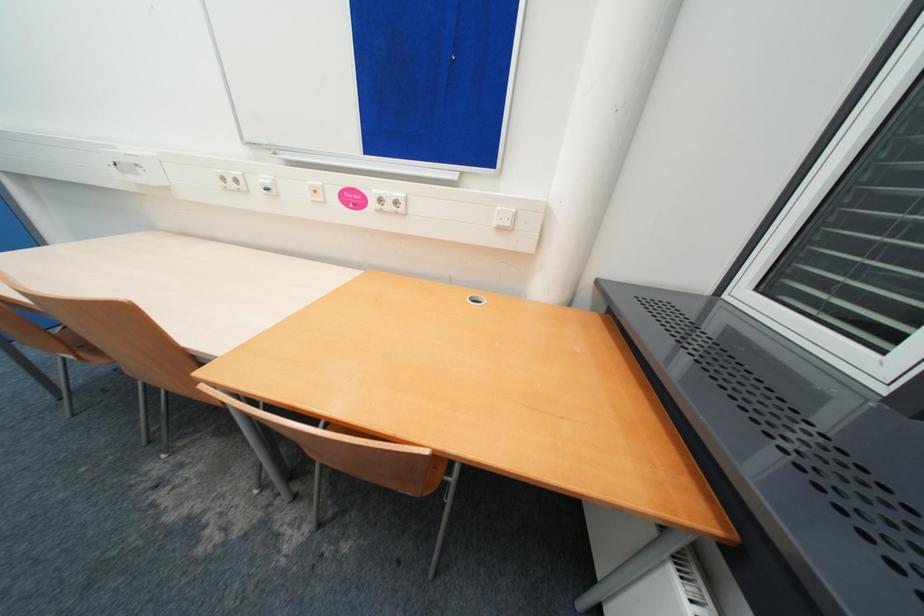
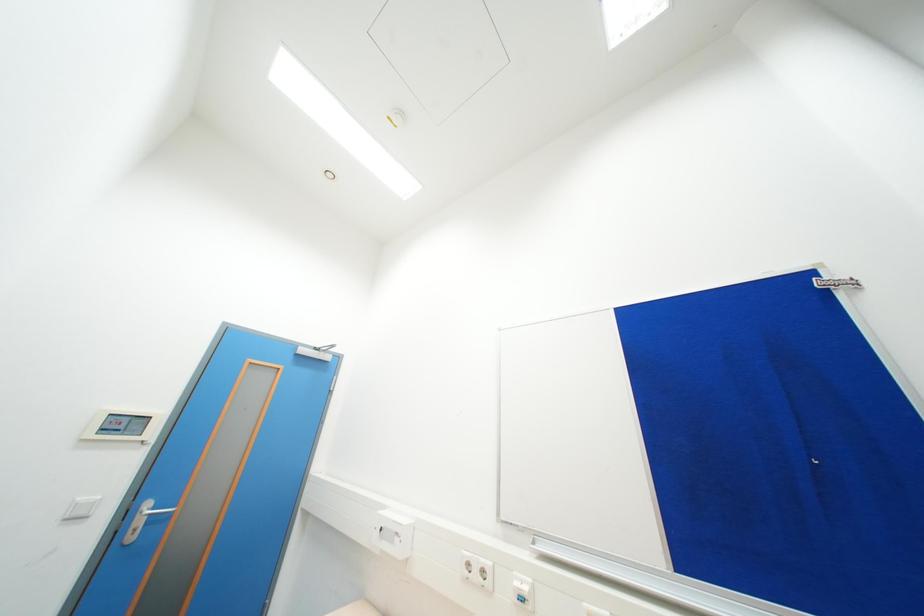
The first image is from the beginning of the video and the second image is from the end. How did the camera likely rotate when shooting the video?

The camera's rotation is toward left-up.